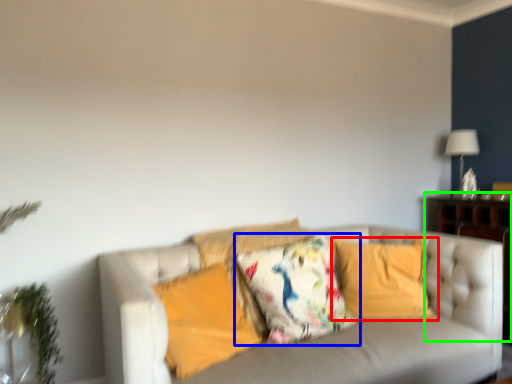
Question: Which object is the closest to the pillow (highlighted by a red box)? Choose among these: pillow (highlighted by a blue box) or dresser (highlighted by a green box).

Choices:
 (A) pillow
 (B) dresser

Answer: (A)